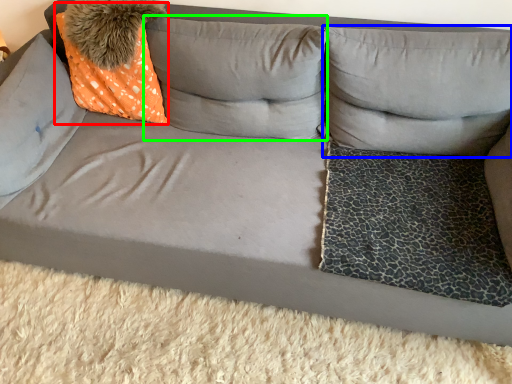
Question: Based on their relative distances, which object is nearer to throw pillow (highlighted by a red box)? Choose from pillow (highlighted by a blue box) and pillow (highlighted by a green box).

Choices:
 (A) pillow
 (B) pillow

Answer: (B)